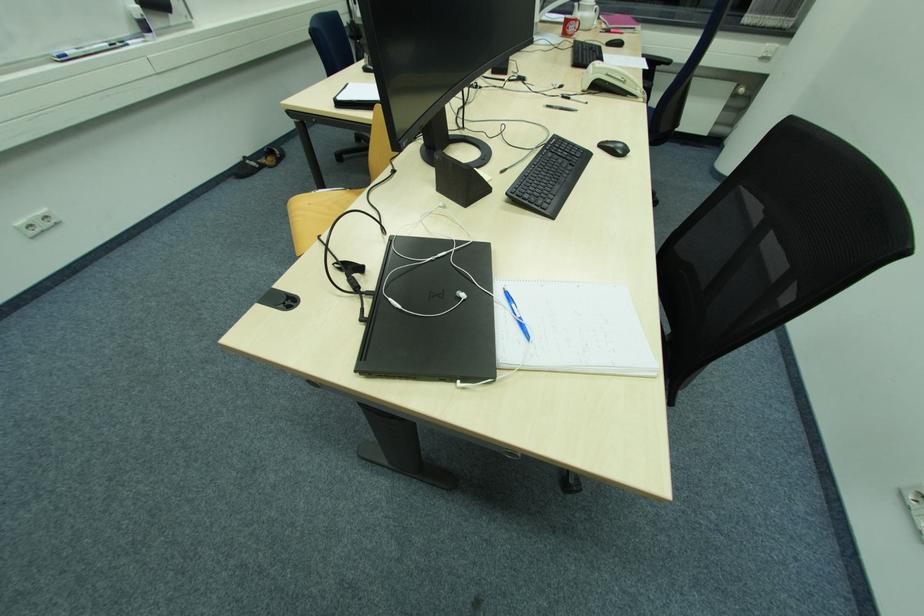
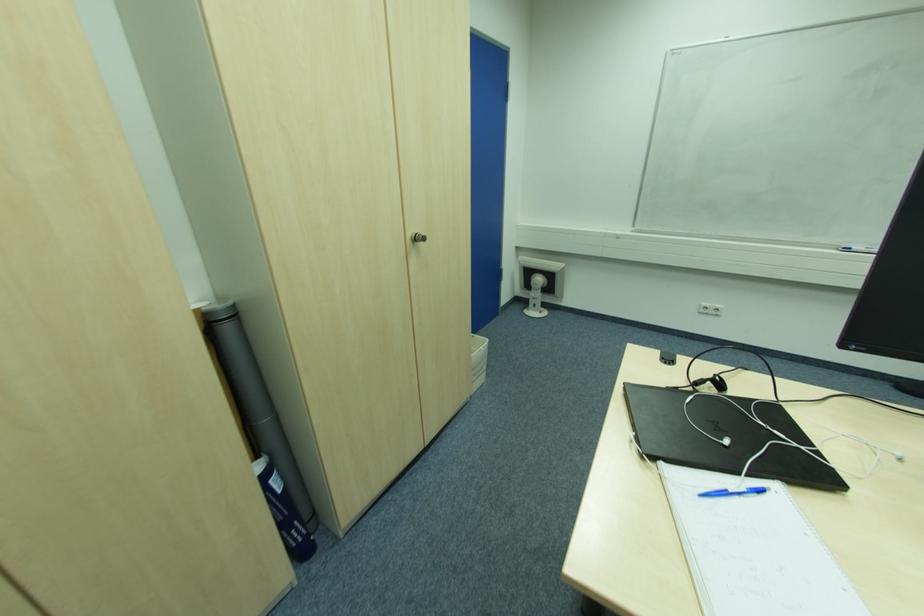
Locate, in the second image, the point that corresponds to point 465,296 in the first image.

(728, 443)